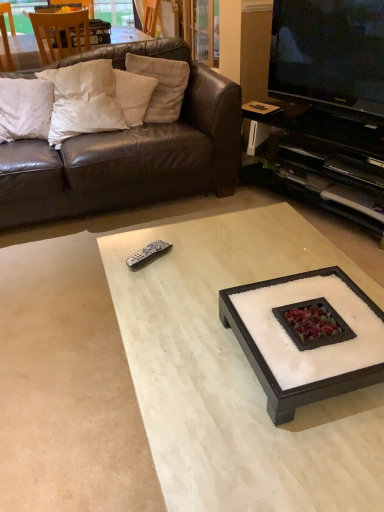
This screenshot has width=384, height=512. Find the location of `vacant space situated on the left part of white marble coffee table at center, which is the 1th coffee table in bottom-to-top order`. vacant space situated on the left part of white marble coffee table at center, which is the 1th coffee table in bottom-to-top order is located at coordinates (64, 381).